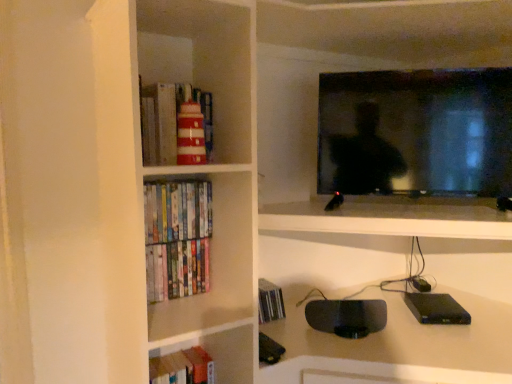
Question: From a real-world perspective, is hardcover books at lower left above or below hardcover books at left?

Choices:
 (A) below
 (B) above

Answer: (A)

Question: Considering the positions of hardcover books at lower left and hardcover books at left in the image, is hardcover books at lower left taller or shorter than hardcover books at left?

Choices:
 (A) short
 (B) tall

Answer: (B)

Question: Estimate the real-world distances between objects in this image. Which object is closer to the hardcover books at left?

Choices:
 (A) hardcover books at lower left
 (B) black glossy tv at upper right

Answer: (A)

Question: Which object is positioned closest to the hardcover books at left?

Choices:
 (A) black glossy tv at upper right
 (B) hardcover books at lower left

Answer: (B)